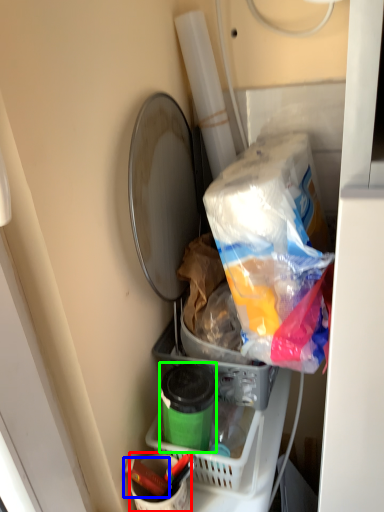
Question: Which object is positioned closest to bucket (highlighted by a red box)? Select from crayon (highlighted by a blue box) and bottle (highlighted by a green box).

Choices:
 (A) crayon
 (B) bottle

Answer: (A)